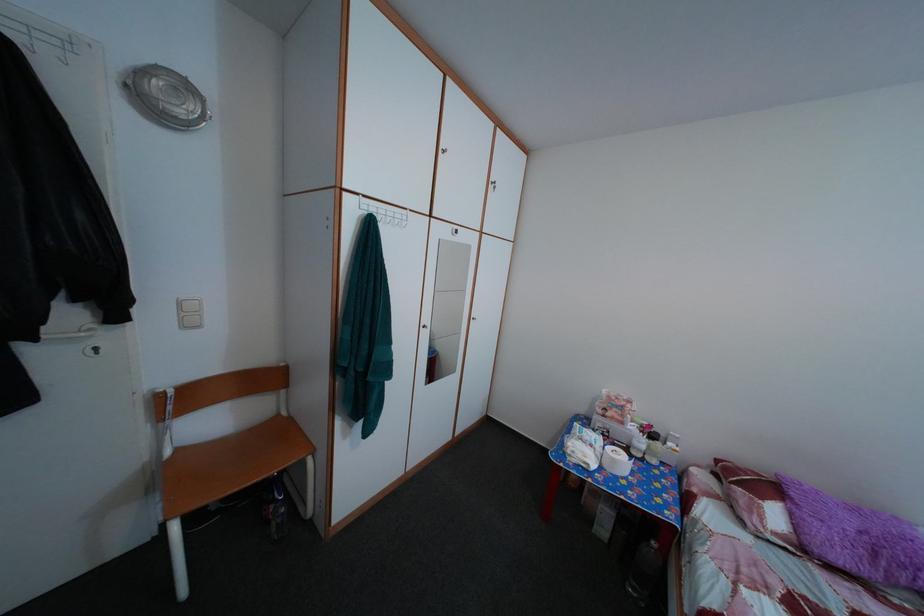
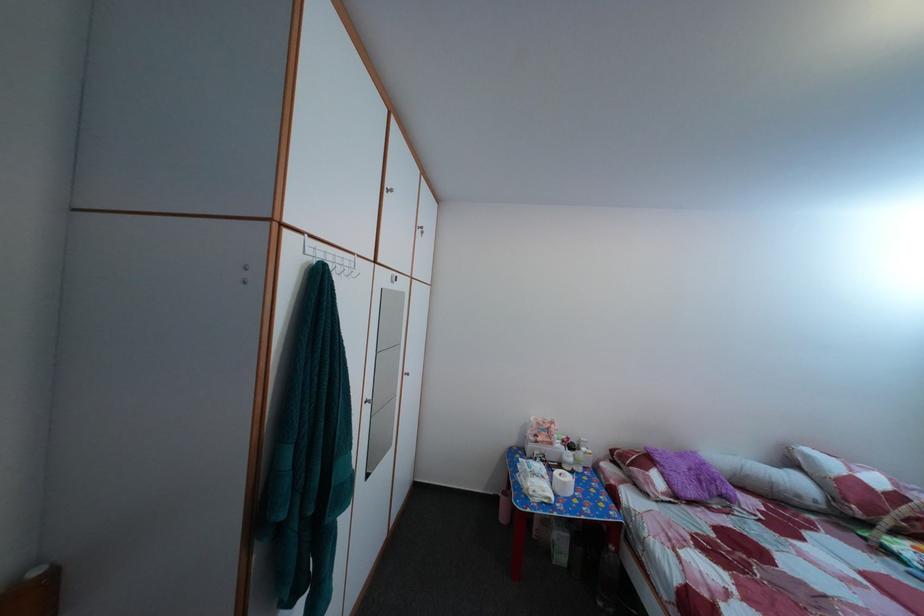
In the second image, find the point that corresponds to (660,435) in the first image.

(578, 447)